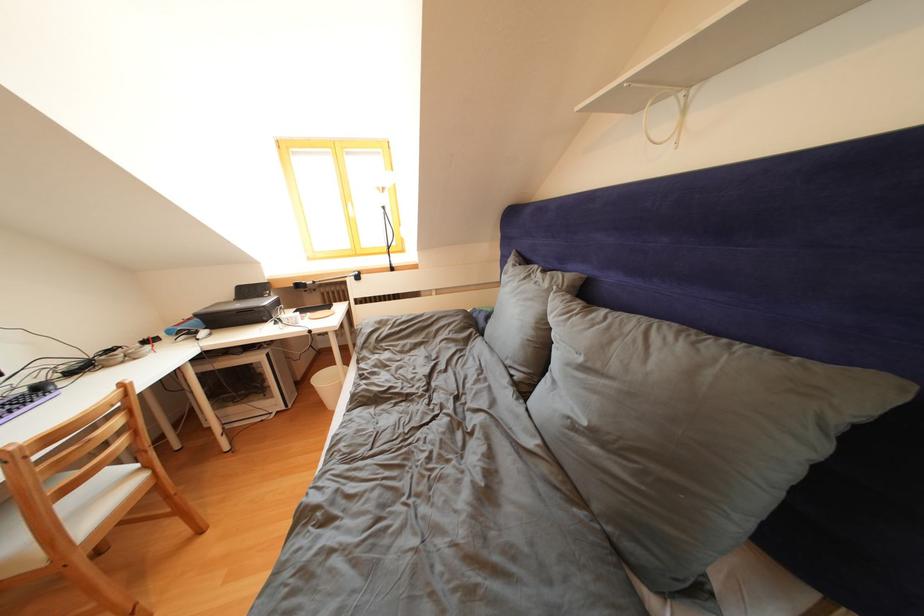
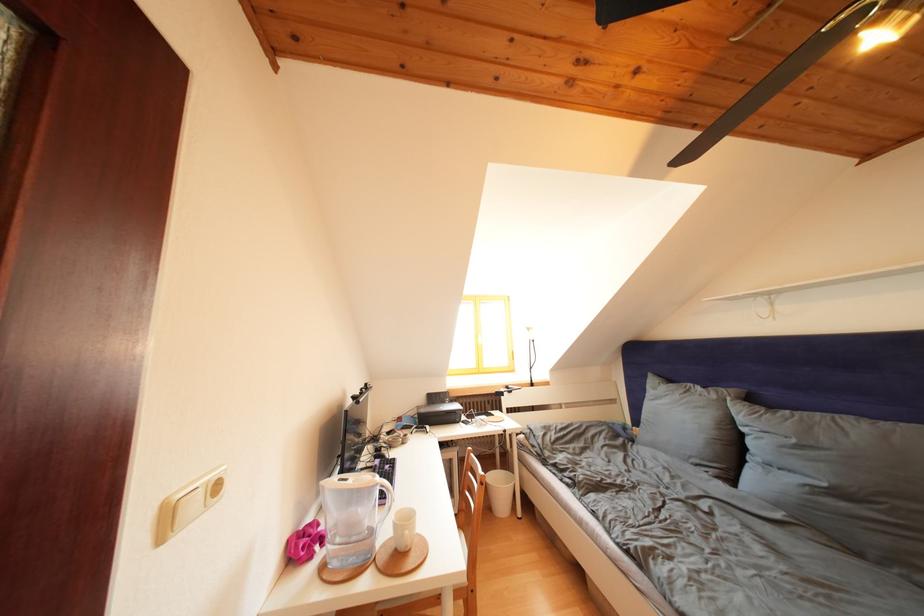
Find the pixel in the second image that matches (590,363) in the first image.

(801, 446)